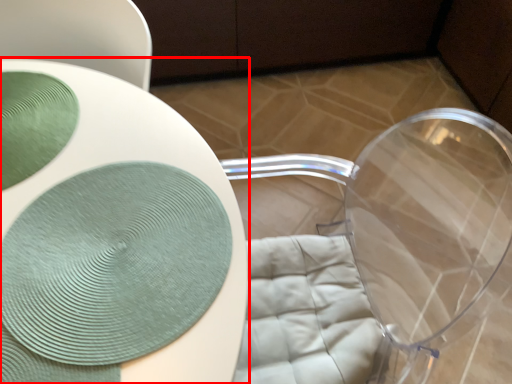
Question: From the image's perspective, considering the relative positions of table (annotated by the red box) and glass plate in the image provided, where is table (annotated by the red box) located with respect to the staircase?

Choices:
 (A) below
 (B) above

Answer: (A)